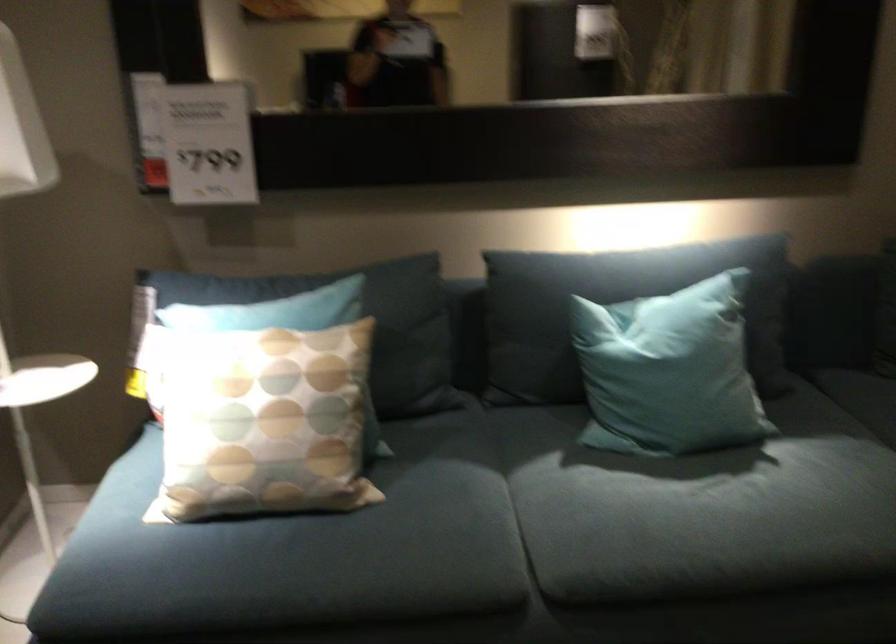
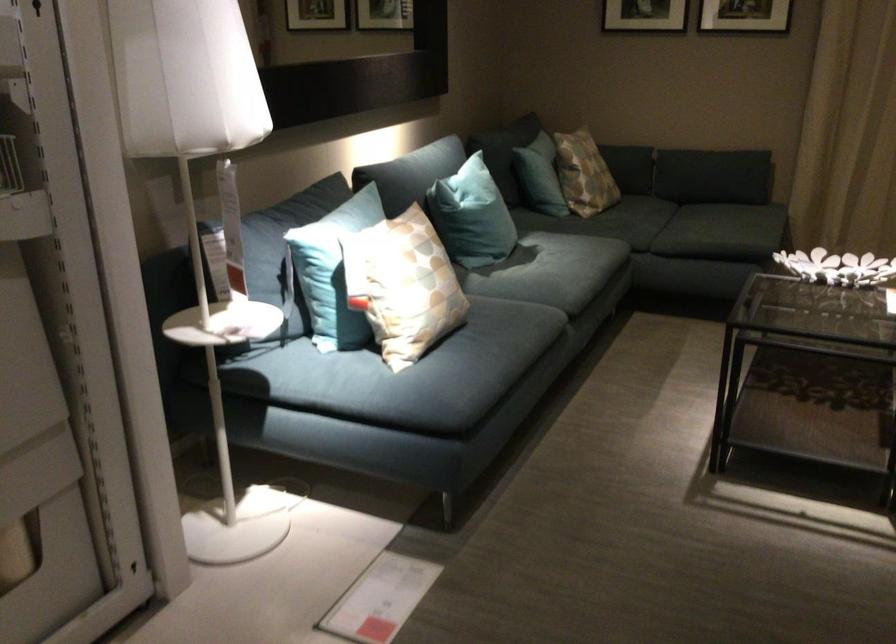
Find the pixel in the second image that matches (221,362) in the first image.

(332, 270)